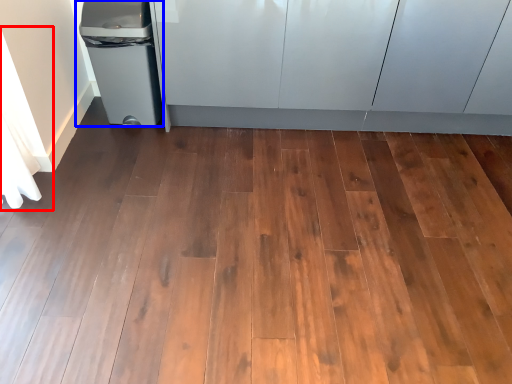
Question: Which object is further to the camera taking this photo, curtain (highlighted by a red box) or waste container (highlighted by a blue box)?

Choices:
 (A) curtain
 (B) waste container

Answer: (B)